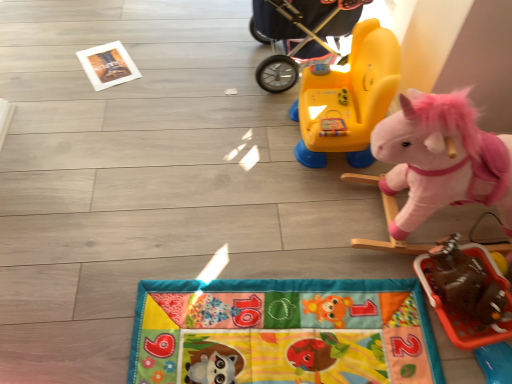
This screenshot has height=384, width=512. Identify the location of vacant space to the left of yellow plastic rocker at upper center, the 3th toy when ordered from bottom to top. (266, 148).